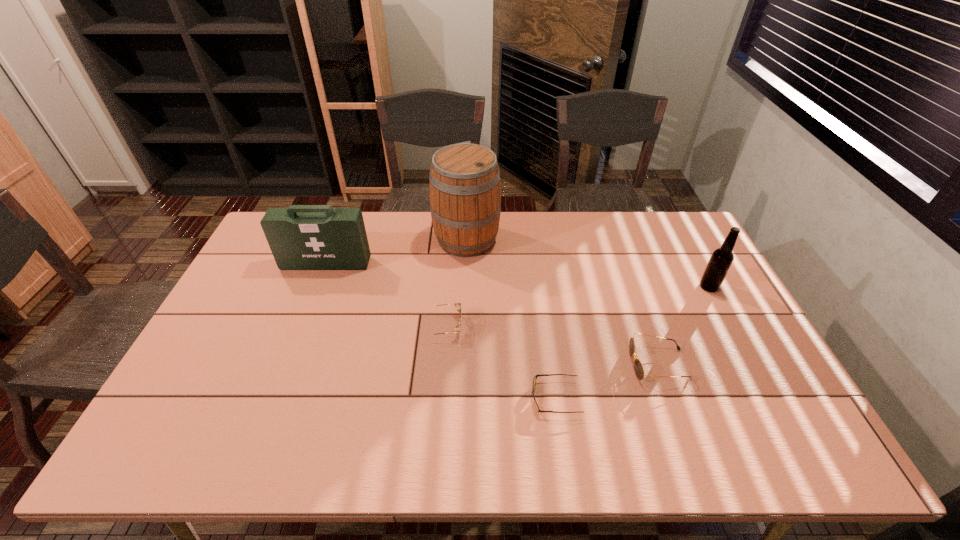
This screenshot has height=540, width=960. I want to click on the second closest sunglasses to the leftmost object, so click(x=535, y=377).

Locate which sunglasses is the closest to the farthest sunglasses. Please provide its 2D coordinates. Your answer should be formatted as a tuple, i.e. [(x, y)], where the tuple contains the x and y coordinates of a point satisfying the conditions above.

[(535, 377)]

Find the location of a particular element. Image resolution: width=960 pixels, height=540 pixels. vacant position in the image that satisfies the following two spatial constraints: 1. on the front side of the rightmost object; 2. on the front-facing side of the shortest object is located at coordinates (769, 398).